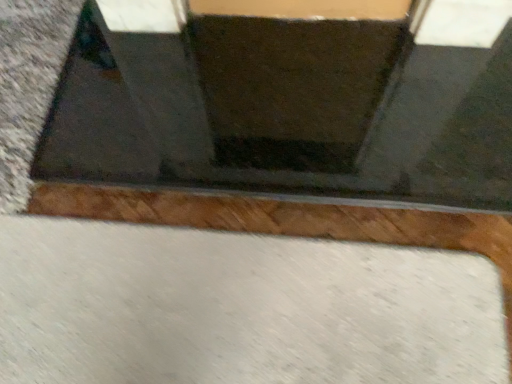
The image size is (512, 384). What do you see at coordinates (239, 308) in the screenshot?
I see `white matte concrete at bottom` at bounding box center [239, 308].

You are a GUI agent. You are given a task and a screenshot of the screen. Output one action in this format:
    pyautogui.click(x=<x>, y=<y>)
    Task: Click on the white matte concrete at bottom
    The image size is (512, 384).
    Given the screenshot: What is the action you would take?
    pyautogui.click(x=239, y=308)

Find the location of a particular element. The width and height of the screenshot is (512, 384). white matte concrete at bottom is located at coordinates (239, 308).